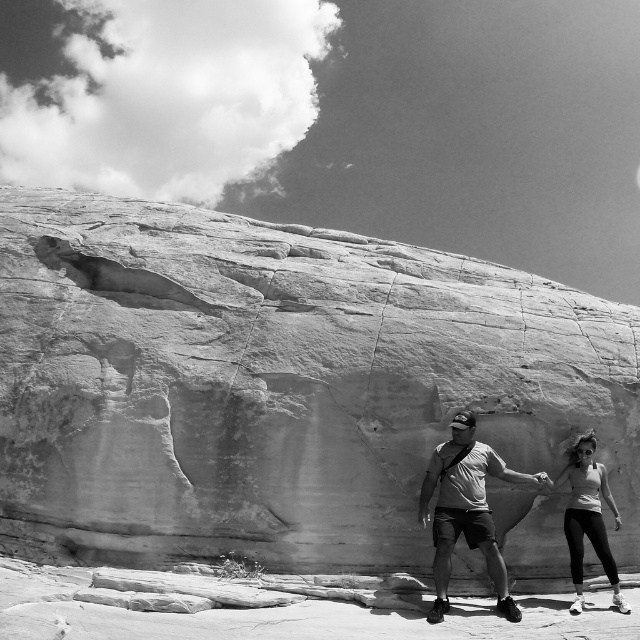
Is matte gray shorts at center taller than smooth white tank top at lower right?

Incorrect, matte gray shorts at center's height is not larger of smooth white tank top at lower right's.

Is matte gray shorts at center thinner than smooth white tank top at lower right?

Correct, matte gray shorts at center's width is less than smooth white tank top at lower right's.

Between point (440, 448) and point (582, 500), which one is positioned behind?

The point (582, 500) is more distant.

Find the location of a particular element. The height and width of the screenshot is (640, 640). matte gray shorts at center is located at coordinates (467, 509).

Does smooth stone rock at center have a smaller size compared to smooth white tank top at lower right?

Incorrect, smooth stone rock at center is not smaller in size than smooth white tank top at lower right.

Does smooth stone rock at center have a larger size compared to smooth white tank top at lower right?

Yes.

At what (x,y) coordinates should I click in order to perform the action: click on smooth stone rock at center. Please return your answer as a coordinate pair (x, y). This screenshot has width=640, height=640. Looking at the image, I should click on (276, 381).

Based on the photo, does smooth stone rock at center appear over matte gray shorts at center?

Yes.

In the scene shown: Which is more to the right, smooth stone rock at center or matte gray shorts at center?

matte gray shorts at center

Find the location of a particular element. Image resolution: width=640 pixels, height=640 pixels. smooth stone rock at center is located at coordinates 276,381.